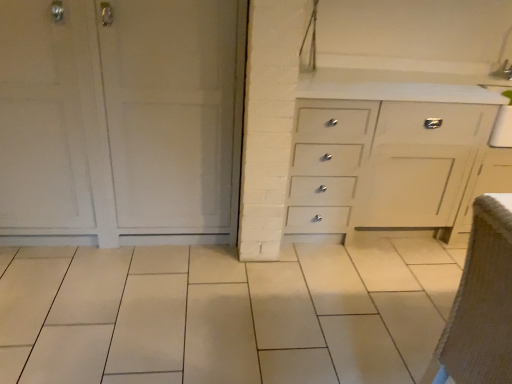
Image resolution: width=512 pixels, height=384 pixels. What do you see at coordinates (481, 303) in the screenshot? I see `brown fabric armchair at lower right` at bounding box center [481, 303].

The image size is (512, 384). I want to click on brown fabric armchair at lower right, so click(x=481, y=303).

What do you see at coordinates (120, 121) in the screenshot? I see `white matte cabinet at left` at bounding box center [120, 121].

Measure the distance between white matte cabinet at left and camera.

white matte cabinet at left and camera are 1.74 meters apart.

You are a GUI agent. You are given a task and a screenshot of the screen. Output one action in this format:
    pyautogui.click(x=<x>, y=<y>)
    Task: Click on the white matte cabinet at left
    Image resolution: width=512 pixels, height=384 pixels.
    Given the screenshot: What is the action you would take?
    pyautogui.click(x=120, y=121)

In order to click on brown fabric armchair at lower right in this screenshot , I will do `click(481, 303)`.

Is white matte cabinet at left at the left side of brown fabric armchair at lower right?

Correct, you'll find white matte cabinet at left to the left of brown fabric armchair at lower right.

Which object is closer to the camera, white matte cabinet at left or brown fabric armchair at lower right?

Positioned in front is brown fabric armchair at lower right.

Does point (147, 141) come in front of point (497, 292)?

No, (147, 141) is further to viewer.

From the image's perspective, is white matte cabinet at left located above brown fabric armchair at lower right?

Yes, from the image's perspective, white matte cabinet at left is over brown fabric armchair at lower right.

From a real-world perspective, who is located higher, white matte cabinet at left or brown fabric armchair at lower right?

white matte cabinet at left is physically above.

In the scene shown: Can you confirm if white matte cabinet at left is thinner than brown fabric armchair at lower right?

In fact, white matte cabinet at left might be wider than brown fabric armchair at lower right.

Considering the relative sizes of white matte cabinet at left and brown fabric armchair at lower right in the image provided, is white matte cabinet at left shorter than brown fabric armchair at lower right?

No.

Based on their sizes in the image, would you say white matte cabinet at left is bigger or smaller than brown fabric armchair at lower right?

Considering their sizes, white matte cabinet at left takes up more space than brown fabric armchair at lower right.

Could brown fabric armchair at lower right be considered to be inside white matte cabinet at left?

That's incorrect, brown fabric armchair at lower right is not inside white matte cabinet at left.

Is white matte cabinet at left far from brown fabric armchair at lower right?

Yes.

Is white matte cabinet at left positioned with its back to brown fabric armchair at lower right?

No, white matte cabinet at left is not facing the opposite direction of brown fabric armchair at lower right.

Can you tell me how much white matte cabinet at left and brown fabric armchair at lower right differ in facing direction?

white matte cabinet at left and brown fabric armchair at lower right are facing 90.4 degrees away from each other.

The image size is (512, 384). Identify the location of door above the brown fabric armchair at lower right (from the image's perspective). (120, 121).

Considering the positions of objects brown fabric armchair at lower right and white matte cabinet at left in the image provided, who is more to the left, brown fabric armchair at lower right or white matte cabinet at left?

white matte cabinet at left is more to the left.

Which object is closer to the camera taking this photo, brown fabric armchair at lower right or white matte cabinet at left?

brown fabric armchair at lower right.

Is point (472, 300) farther from viewer compared to point (225, 165)?

No, it is in front of (225, 165).

From the image's perspective, is brown fabric armchair at lower right located above or below white matte cabinet at left?

brown fabric armchair at lower right is situated lower than white matte cabinet at left in the image.

From a real-world perspective, is brown fabric armchair at lower right beneath white matte cabinet at left?

Yes, from a real-world perspective, brown fabric armchair at lower right is under white matte cabinet at left.

Which object is thinner, brown fabric armchair at lower right or white matte cabinet at left?

brown fabric armchair at lower right.

Considering the sizes of objects brown fabric armchair at lower right and white matte cabinet at left in the image provided, who is taller, brown fabric armchair at lower right or white matte cabinet at left?

white matte cabinet at left is taller.

Does brown fabric armchair at lower right have a smaller size compared to white matte cabinet at left?

Yes.

Would you say brown fabric armchair at lower right contains white matte cabinet at left?

No, brown fabric armchair at lower right does not contain white matte cabinet at left.

Is brown fabric armchair at lower right next to white matte cabinet at left and touching it?

No, brown fabric armchair at lower right is not next to white matte cabinet at left.

Is brown fabric armchair at lower right facing away from white matte cabinet at left?

No.

Locate an element on the screen. door that appears behind the brown fabric armchair at lower right is located at coordinates (120, 121).

Identify the location of door on the left of brown fabric armchair at lower right. Image resolution: width=512 pixels, height=384 pixels. (120, 121).

This screenshot has width=512, height=384. I want to click on door above the brown fabric armchair at lower right (from a real-world perspective), so click(x=120, y=121).